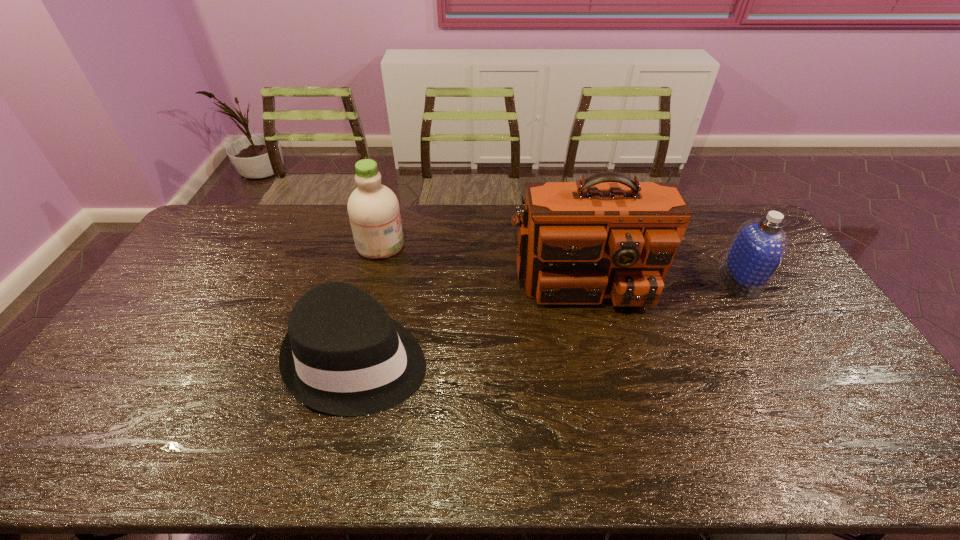
Locate an element on the screen. free location that satisfies the following two spatial constraints: 1. on the face side of the tallest object; 2. on the right side of the third tallest object is located at coordinates (587, 280).

The height and width of the screenshot is (540, 960). I want to click on free point that satisfies the following two spatial constraints: 1. on the face side of the shorter cleansing agent; 2. on the right side of the satchel, so click(x=587, y=280).

In order to click on vacant space that satisfies the following two spatial constraints: 1. on the back side of the nearer cleansing agent; 2. on the front label of the left cleansing agent in this screenshot , I will do `click(719, 245)`.